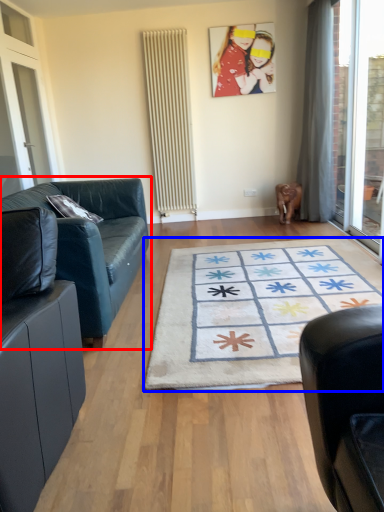
Question: Which object appears closest to the camera in this image, studio couch (highlighted by a red box) or mat (highlighted by a blue box)?

Choices:
 (A) studio couch
 (B) mat

Answer: (B)